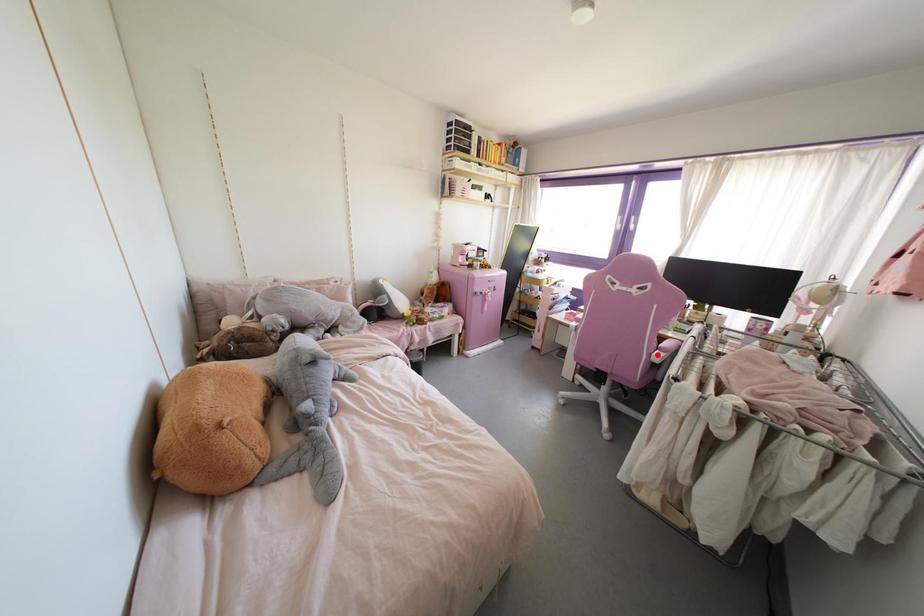
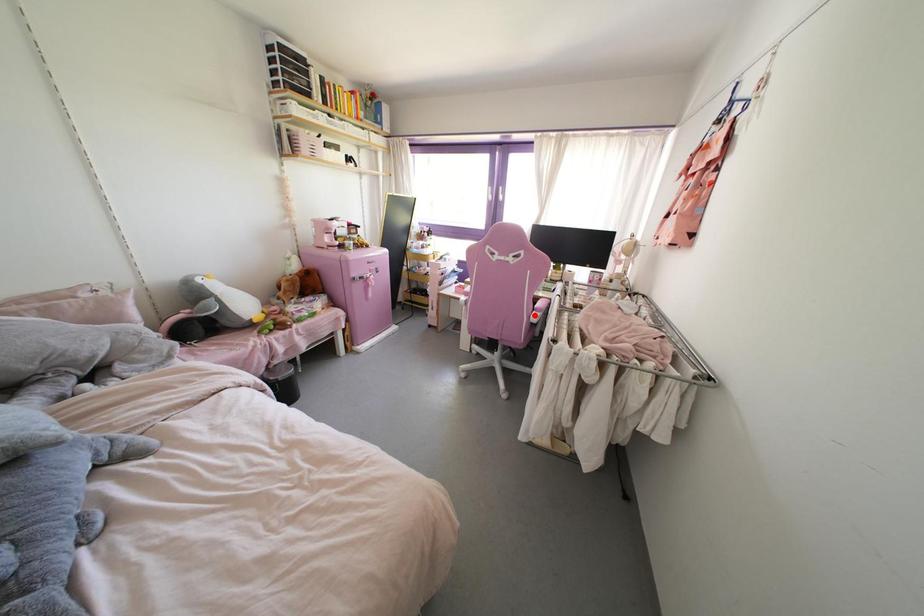
I am providing you with two images of the same scene from different viewpoints. A red point is marked on the first image and another point is marked on the second image. Is the marked point in image1 the same physical position as the marked point in image2?

Yes